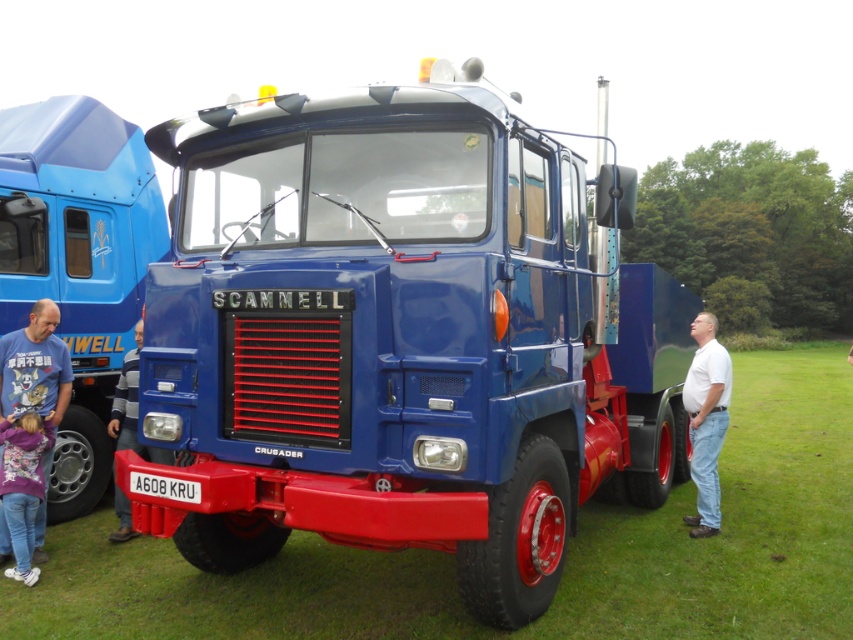
Question: Which is nearer to the green grass at lower center?

Choices:
 (A) matte blue t-shirt at lower left
 (B) glossy blue truck at center
 (C) white cotton shirt at center
 (D) blue striped shirt at lower left

Answer: (B)

Question: Which point appears closest to the camera in this image?

Choices:
 (A) (123, 509)
 (B) (477, 216)

Answer: (B)

Question: Does matte blue t-shirt at lower left have a larger size compared to white cotton shirt at center?

Choices:
 (A) yes
 (B) no

Answer: (B)

Question: Which of these objects is positioned farthest from the floral hoodie at lower left?

Choices:
 (A) green grass at lower center
 (B) matte blue t-shirt at lower left
 (C) white cotton shirt at center
 (D) blue striped shirt at lower left

Answer: (C)

Question: Is green grass at lower center below blue striped shirt at lower left?

Choices:
 (A) no
 (B) yes

Answer: (B)

Question: Can you confirm if matte blue truck at center is wider than white cotton shirt at center?

Choices:
 (A) no
 (B) yes

Answer: (B)